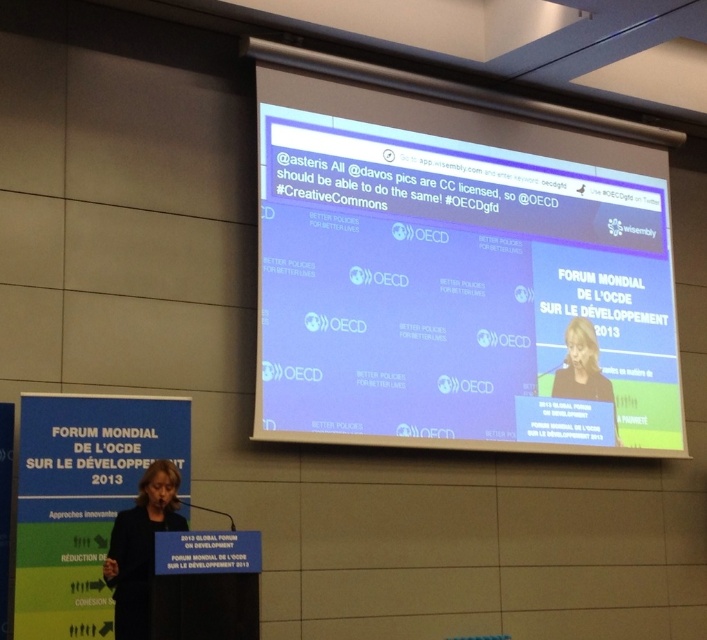
Between white matte projection screen at upper center and dark gray suit at center, which one appears on the right side from the viewer's perspective?

From the viewer's perspective, dark gray suit at center appears more on the right side.

Is white matte projection screen at upper center closer to the viewer compared to dark gray suit at center?

Yes.

At what (x,y) coordinates should I click in order to perform the action: click on white matte projection screen at upper center. Please return your answer as a coordinate pair (x, y). Looking at the image, I should click on (460, 289).

Is dark blue fabric at center below dark gray suit at center?

Indeed, dark blue fabric at center is positioned under dark gray suit at center.

Can you confirm if dark blue fabric at center is wider than dark gray suit at center?

In fact, dark blue fabric at center might be narrower than dark gray suit at center.

Who is more forward, (156, 502) or (612, 397)?

Point (156, 502)

Where is `dark blue fabric at center`? dark blue fabric at center is located at coordinates (140, 547).

Who is more distant from viewer, (493, 204) or (119, 637)?

Point (493, 204)

Find the location of `white matte projection screen at upper center`. white matte projection screen at upper center is located at coordinates (460, 289).